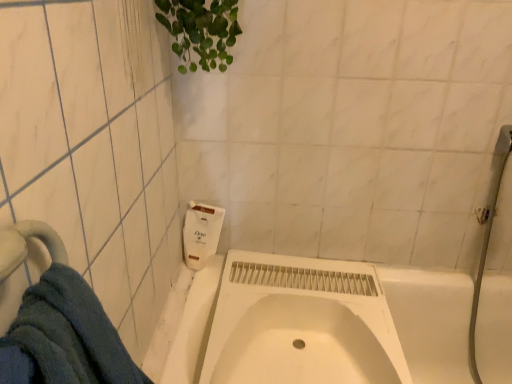
Describe the element at coordinates (201, 233) in the screenshot. The image size is (512, 384). I see `white matte soap dispenser at upper center` at that location.

Image resolution: width=512 pixels, height=384 pixels. Identify the location of blue cotton towel at lower left. (65, 337).

The width and height of the screenshot is (512, 384). Describe the element at coordinates (431, 321) in the screenshot. I see `white matte bathtub at center` at that location.

The width and height of the screenshot is (512, 384). Find the location of `white matte soap dispenser at upper center`. white matte soap dispenser at upper center is located at coordinates (201, 233).

Between point (114, 348) and point (394, 356), which one is positioned behind?

The point (394, 356) is more distant.

Considering the relative sizes of blue cotton towel at lower left and white matte bathtub at center in the image provided, is blue cotton towel at lower left bigger than white matte bathtub at center?

Actually, blue cotton towel at lower left might be smaller than white matte bathtub at center.

Would you consider blue cotton towel at lower left to be distant from white matte bathtub at center?

blue cotton towel at lower left is far away from white matte bathtub at center.

Is white matte soap dispenser at upper center surrounding white matte bathtub at center?

No, white matte bathtub at center is not inside white matte soap dispenser at upper center.

Does point (201, 240) come in front of point (208, 263)?

Yes, point (201, 240) is closer to viewer.

Considering the relative sizes of white matte soap dispenser at upper center and white matte bathtub at center in the image provided, is white matte soap dispenser at upper center taller than white matte bathtub at center?

Incorrect, the height of white matte soap dispenser at upper center is not larger of that of white matte bathtub at center.

Does white matte soap dispenser at upper center turn towards white matte bathtub at center?

No, white matte soap dispenser at upper center is not aimed at white matte bathtub at center.

From the picture: Is white matte soap dispenser at upper center wider or thinner than white matte sink at center?

Considering their sizes, white matte soap dispenser at upper center looks slimmer than white matte sink at center.

Is white matte soap dispenser at upper center positioned far away from white matte sink at center?

No, white matte soap dispenser at upper center is not far from white matte sink at center.

Between white matte soap dispenser at upper center and white matte sink at center, which one has less height?

white matte sink at center is shorter.

Who is more distant, white matte bathtub at center or white matte sink at center?

white matte bathtub at center is behind.

Does white matte bathtub at center touch white matte sink at center?

No, white matte bathtub at center is not with white matte sink at center.

You are a GUI agent. You are given a task and a screenshot of the screen. Output one action in this format:
    pyautogui.click(x=<x>, y=<y>)
    Task: Click on the bath that appears below the white matte sink at center (from a real-world perspective)
    
    Given the screenshot: What is the action you would take?
    pyautogui.click(x=431, y=321)

Is white matte sink at center far away from white matte soap dispenser at upper center?

They are positioned close to each other.

From a real-world perspective, which object rests below the other?

white matte sink at center, from a real-world perspective.

Is white matte sink at center closer to the viewer compared to white matte soap dispenser at upper center?

Yes.

The height and width of the screenshot is (384, 512). I want to click on soap dispenser that is above the white matte sink at center (from the image's perspective), so click(201, 233).

How far apart are white matte sink at center and blue cotton towel at lower left?

27.18 inches.

Based on the photo, which is closer to the camera, [273,380] or [41,352]?

Point [41,352]

Does white matte sink at center touch blue cotton towel at lower left?

white matte sink at center and blue cotton towel at lower left are clearly separated.

Based on the photo, from a real-world perspective, is white matte bathtub at center on white matte soap dispenser at upper center?

Incorrect, from a real-world perspective, white matte bathtub at center is lower than white matte soap dispenser at upper center.

What's the angular difference between white matte bathtub at center and white matte soap dispenser at upper center's facing directions?

There is a 0.946-degree angle between the facing directions of white matte bathtub at center and white matte soap dispenser at upper center.

Is white matte bathtub at center in contact with white matte soap dispenser at upper center?

white matte bathtub at center and white matte soap dispenser at upper center are clearly separated.

How far apart are white matte bathtub at center and white matte soap dispenser at upper center?

white matte bathtub at center is 27.98 inches from white matte soap dispenser at upper center.

The width and height of the screenshot is (512, 384). Identify the location of towel above the white matte bathtub at center (from the image's perspective). (65, 337).

The height and width of the screenshot is (384, 512). What are the coordinates of `bath below the white matte soap dispenser at upper center (from the image's perspective)` in the screenshot? It's located at click(x=431, y=321).

Considering their positions, is white matte sink at center positioned closer to white matte bathtub at center than blue cotton towel at lower left?

white matte sink at center lies closer to white matte bathtub at center than the other object.

Looking at this image, estimate the real-world distances between objects in this image. Which object is further from white matte soap dispenser at upper center, blue cotton towel at lower left or white matte bathtub at center?

blue cotton towel at lower left.

Estimate the real-world distances between objects in this image. Which object is closer to white matte bathtub at center, blue cotton towel at lower left or white matte soap dispenser at upper center?

Based on the image, white matte soap dispenser at upper center appears to be nearer to white matte bathtub at center.

Consider the image. When comparing their distances from blue cotton towel at lower left, does white matte soap dispenser at upper center or white matte bathtub at center seem further?

white matte bathtub at center lies further to blue cotton towel at lower left than the other object.

In the scene shown: Which object lies nearer to the anchor point blue cotton towel at lower left, white matte sink at center or white matte bathtub at center?

white matte sink at center is closer to blue cotton towel at lower left.

Looking at the image, which one is located further to blue cotton towel at lower left, white matte bathtub at center or white matte soap dispenser at upper center?

Based on the image, white matte bathtub at center appears to be further to blue cotton towel at lower left.

Estimate the real-world distances between objects in this image. Which object is further from white matte sink at center, blue cotton towel at lower left or white matte bathtub at center?

blue cotton towel at lower left lies further to white matte sink at center than the other object.

When comparing their distances from blue cotton towel at lower left, does white matte sink at center or white matte soap dispenser at upper center seem further?

white matte soap dispenser at upper center lies further to blue cotton towel at lower left than the other object.

Where is `sink between blue cotton towel at lower left and white matte bathtub at center along the z-axis`? Image resolution: width=512 pixels, height=384 pixels. sink between blue cotton towel at lower left and white matte bathtub at center along the z-axis is located at coordinates (302, 345).

Identify the location of sink situated between white matte soap dispenser at upper center and white matte bathtub at center from left to right. The width and height of the screenshot is (512, 384). (302, 345).

This screenshot has height=384, width=512. I want to click on sink between blue cotton towel at lower left and white matte soap dispenser at upper center along the z-axis, so click(302, 345).

Identify the location of bath positioned between blue cotton towel at lower left and white matte soap dispenser at upper center from near to far. (431, 321).